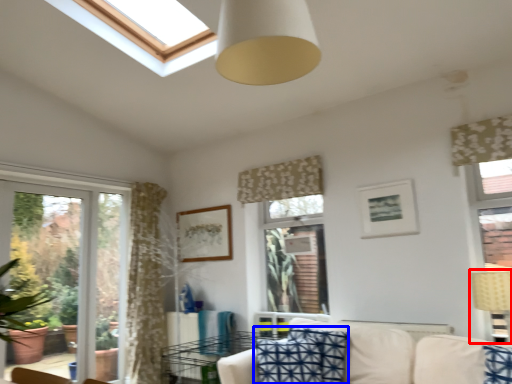
Question: Which of the following is the closest to the observer, table lamp (highlighted by a red box) or pillow (highlighted by a blue box)?

Choices:
 (A) table lamp
 (B) pillow

Answer: (A)